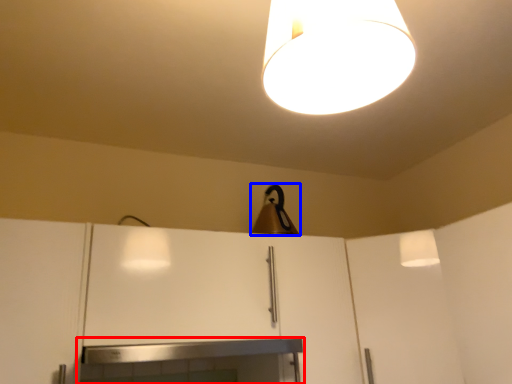
Question: Which of the following is the farthest to the observer, fireplace (highlighted by a red box) or lamp (highlighted by a blue box)?

Choices:
 (A) fireplace
 (B) lamp

Answer: (B)